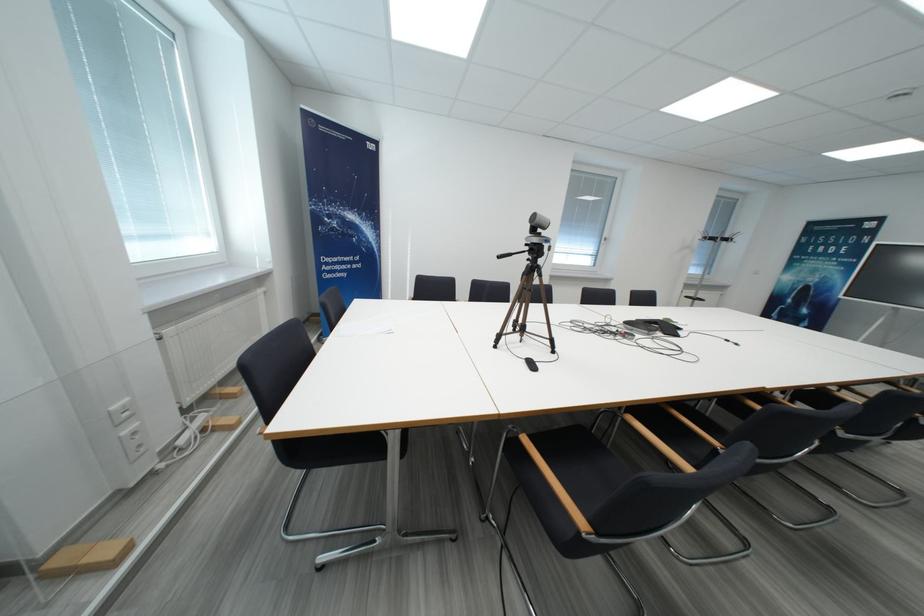
What are the coordinates of `tripod handle` in the screenshot? It's located at (533, 252).